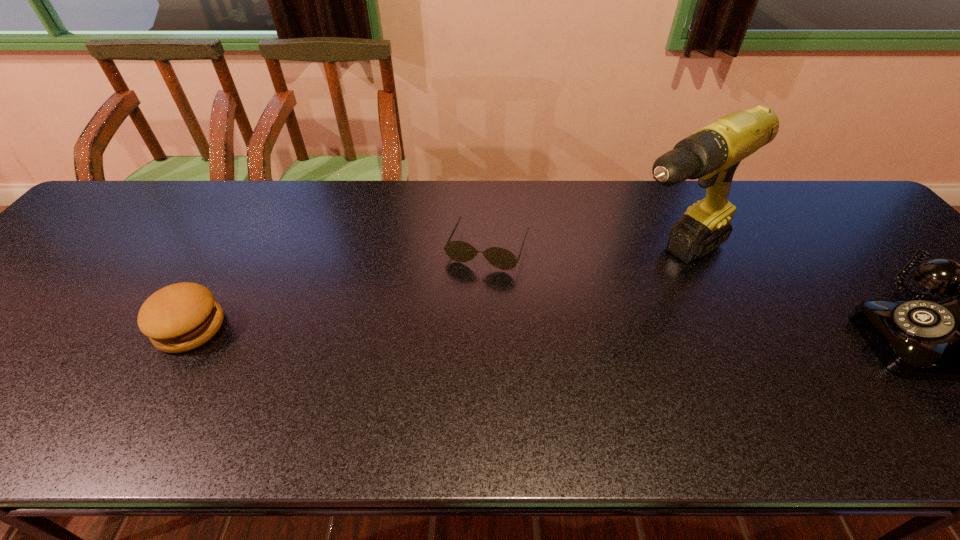
Locate an element on the screen. hamburger is located at coordinates (180, 317).

Locate an element on the screen. the leftmost object is located at coordinates (180, 317).

Where is `drill`? This screenshot has height=540, width=960. drill is located at coordinates (712, 154).

Image resolution: width=960 pixels, height=540 pixels. In order to click on the third object from left to right in this screenshot , I will do `click(712, 154)`.

Image resolution: width=960 pixels, height=540 pixels. Find the location of `sunglasses`. sunglasses is located at coordinates (459, 251).

This screenshot has height=540, width=960. Find the location of `the third object from right to left`. the third object from right to left is located at coordinates (459, 251).

Where is `vacant space located on the right of the hamburger`? The height and width of the screenshot is (540, 960). vacant space located on the right of the hamburger is located at coordinates (276, 328).

Where is `vacant space located on the handle side of the drill`? The height and width of the screenshot is (540, 960). vacant space located on the handle side of the drill is located at coordinates (563, 319).

Where is `vacant position located on the handle side of the drill`? Image resolution: width=960 pixels, height=540 pixels. vacant position located on the handle side of the drill is located at coordinates (611, 288).

The image size is (960, 540). I want to click on free space located on the handle side of the drill, so click(563, 319).